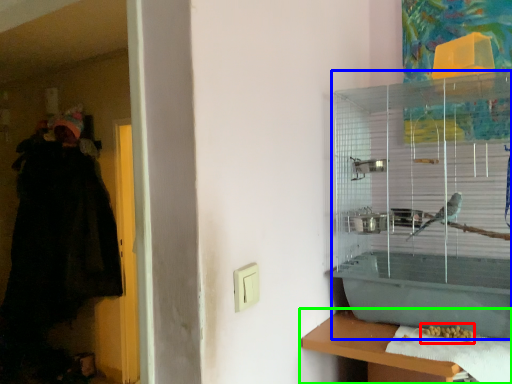
Question: Which object is the closest to the food (highlighted by a red box)? Choose among these: bird cage (highlighted by a blue box) or shelf (highlighted by a green box).

Choices:
 (A) bird cage
 (B) shelf

Answer: (B)